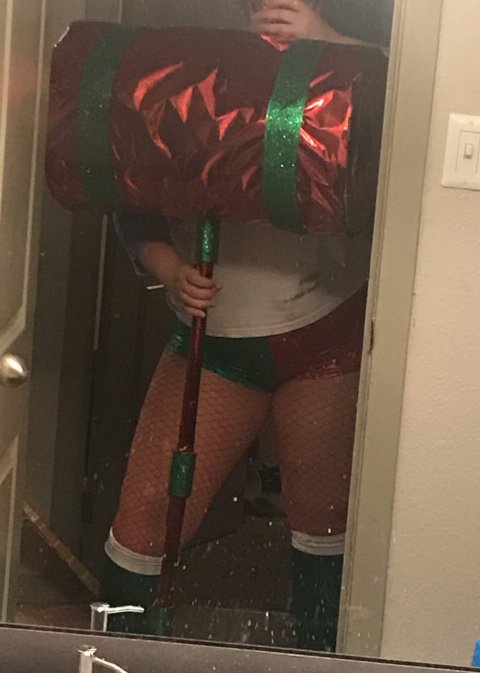
You are a GUI agent. You are given a task and a screenshot of the screen. Output one action in this format:
    pyautogui.click(x=<x>, y=<y>)
    Task: Click on the lightswitch
    This screenshot has height=673, width=480.
    Given the screenshot: What is the action you would take?
    click(466, 151)